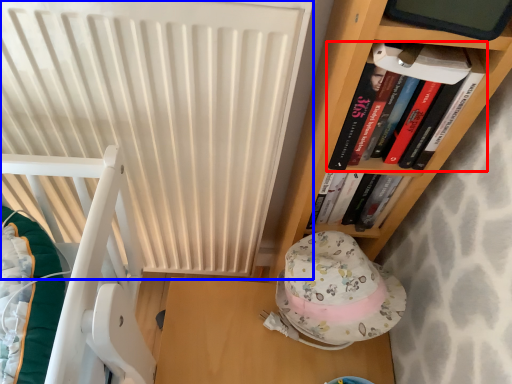
Question: Which point is further to the camera, book (highlighted by a red box) or radiator (highlighted by a blue box)?

Choices:
 (A) book
 (B) radiator

Answer: (A)